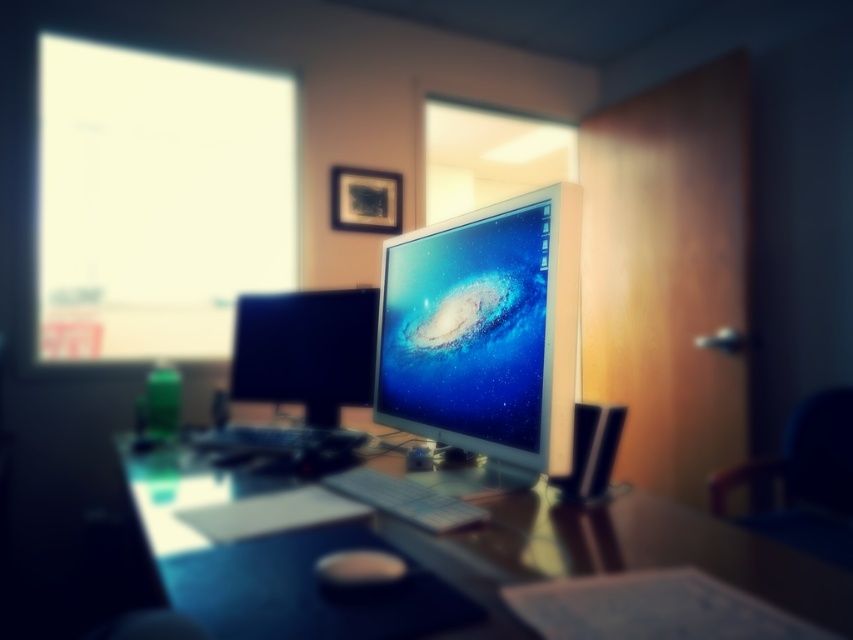
You are standing in front of the desk in the workspace setup. You need to place a small item exactly at point (480,538). If the desk is 60 inches wide, can you fit the item there without it hanging off the edge?

The distance from point (480,538) to the camera is 37.70 inches. Since the desk is 60 inches wide, the item can be placed at that point without hanging off the edge as it is within the desk dimensions.

You are organizing your desk and want to place a new keyboard between the satin silver monitor at center and the matte black mouse at center. Based on their positions, where should the keyboard be placed?

The satin silver monitor at center is located above the matte black mouse at center, so placing the keyboard between them would mean positioning it below the monitor and above the mouse.

You are standing in front of the desk with two points marked on it. The first point is at coordinates point (x=537, y=285) and the second is at point (x=325, y=573). Which point is closer to you?

Point (x=537, y=285) is further to the viewer than point (x=325, y=573), so the second point is closer to you.